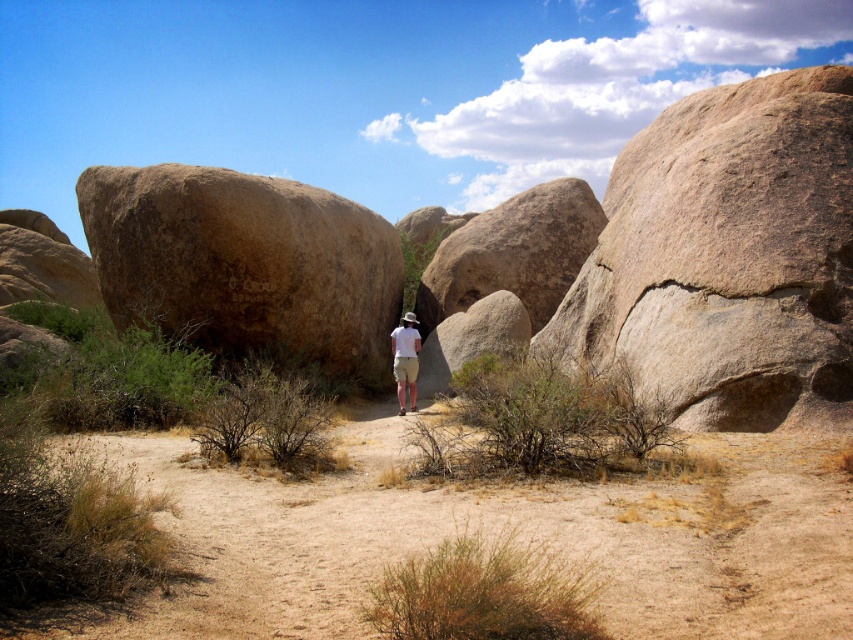
Between brown sandy ground at center and white cotton shirt at center, which one appears on the right side from the viewer's perspective?

brown sandy ground at center

Is brown sandy ground at center shorter than white cotton shirt at center?

Yes, brown sandy ground at center is shorter than white cotton shirt at center.

Is point (357, 580) positioned after point (415, 342)?

That is False.

The image size is (853, 640). I want to click on brown sandy ground at center, so click(486, 536).

Between point (375, 422) and point (126, 221), which one is positioned behind?

The point (126, 221) is behind.

The image size is (853, 640). I want to click on brown sandy ground at center, so click(x=486, y=536).

Find the location of a particular element. brown sandy ground at center is located at coordinates (486, 536).

Is point (343, 490) closer to camera compared to point (717, 349)?

Yes, point (343, 490) is in front of point (717, 349).

The width and height of the screenshot is (853, 640). What do you see at coordinates (486, 536) in the screenshot?
I see `brown sandy ground at center` at bounding box center [486, 536].

Locate an element on the screen. The image size is (853, 640). brown sandy ground at center is located at coordinates (486, 536).